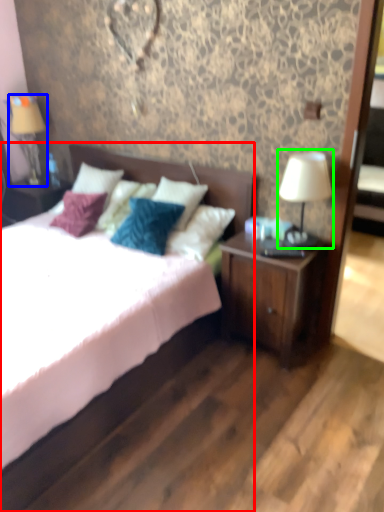
Question: Estimate the real-world distances between objects in this image. Which object is farther from bed (highlighted by a red box), table lamp (highlighted by a blue box) or table lamp (highlighted by a green box)?

Choices:
 (A) table lamp
 (B) table lamp

Answer: (A)